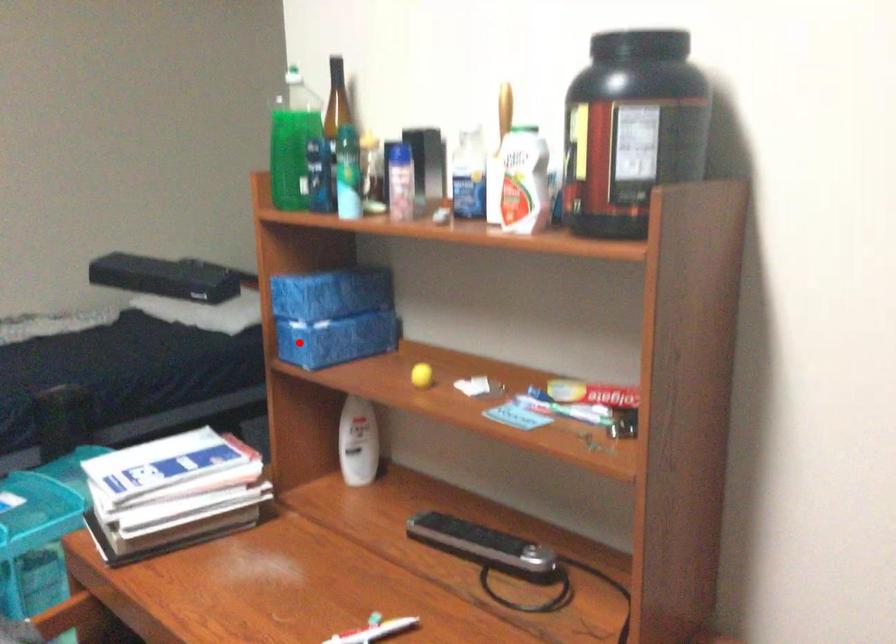
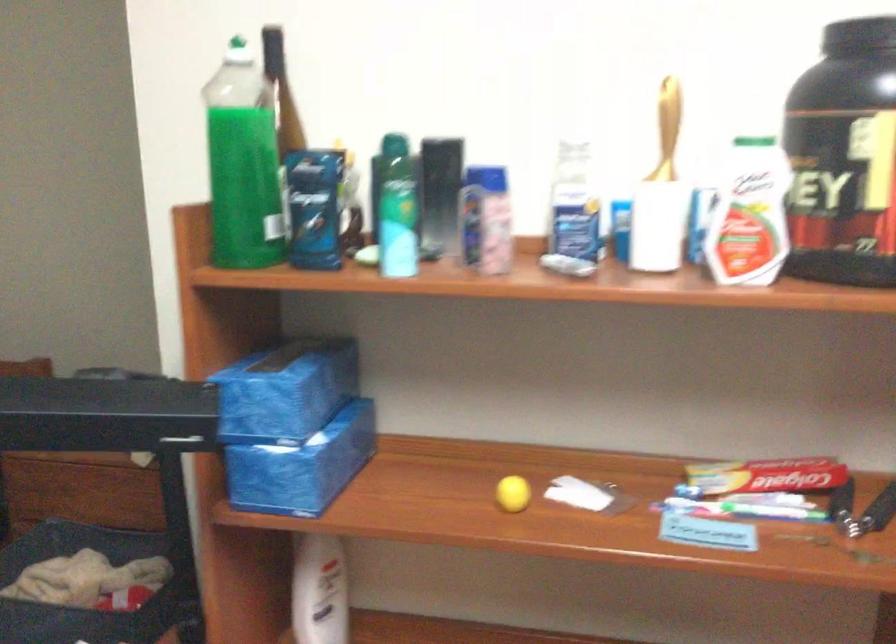
Question: A red point is marked in image1. In image2, is the corresponding 3D point closer to the camera or farther? Reply with the corresponding letter.

Choices:
 (A) The corresponding 3D point is closer.
 (B) The corresponding 3D point is farther.

Answer: (A)